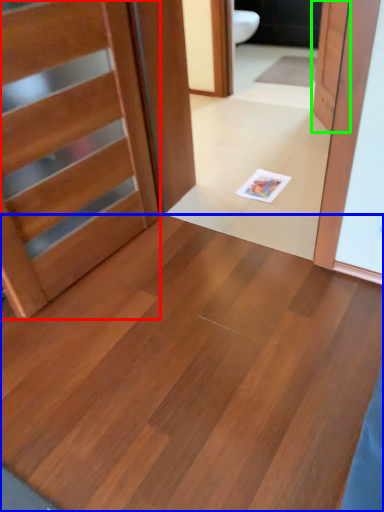
Question: Considering the real-world distances, which object is closest to door (highlighted by a red box)? plywood (highlighted by a blue box) or door (highlighted by a green box).

Choices:
 (A) plywood
 (B) door

Answer: (A)